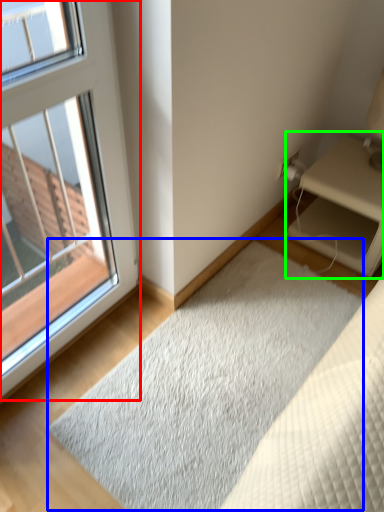
Question: Which is farther away from window (highlighted by a red box)? doormat (highlighted by a blue box) or nightstand (highlighted by a green box)?

Choices:
 (A) doormat
 (B) nightstand

Answer: (B)